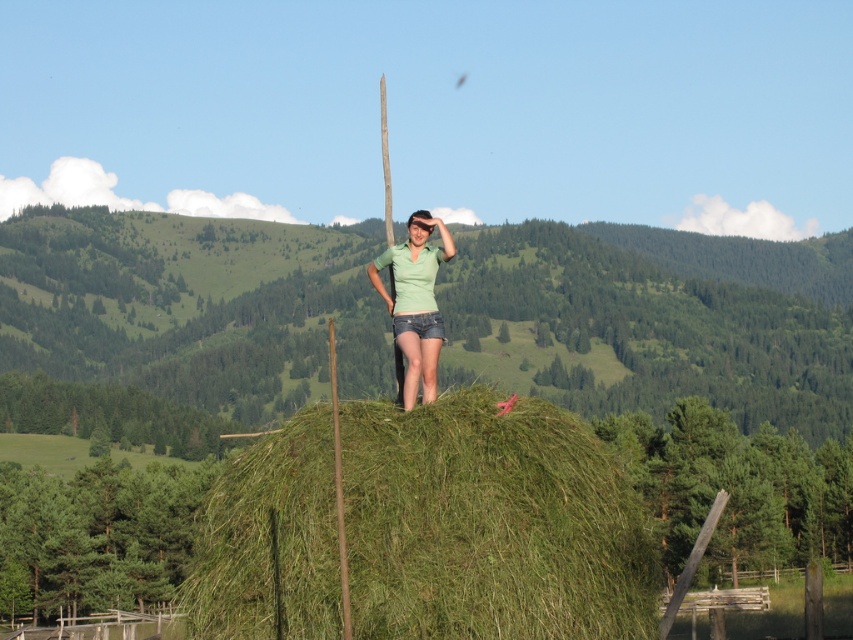
Question: Which point is farther from the camera taking this photo?

Choices:
 (A) (410, 336)
 (B) (624, 576)

Answer: (A)

Question: Is green grassy hay at center to the left of green denim shorts at center from the viewer's perspective?

Choices:
 (A) no
 (B) yes

Answer: (A)

Question: Can you confirm if green grassy hay at center is smaller than green denim shorts at center?

Choices:
 (A) no
 (B) yes

Answer: (A)

Question: Does green grassy hay at center come behind green denim shorts at center?

Choices:
 (A) yes
 (B) no

Answer: (B)

Question: Among these objects, which one is farthest from the camera?

Choices:
 (A) green denim shorts at center
 (B) green grassy hay at center

Answer: (A)

Question: Which object is closer to the camera taking this photo?

Choices:
 (A) green denim shorts at center
 (B) green grassy hay at center

Answer: (B)